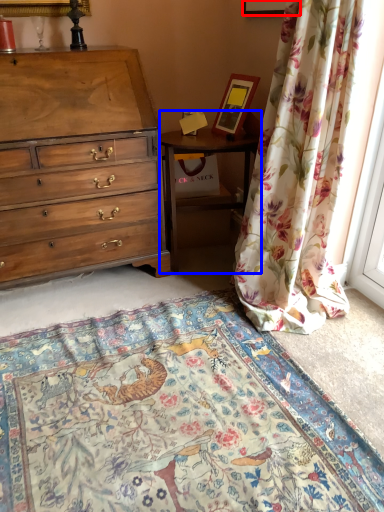
Question: Which object is closer to the camera taking this photo, picture frame (highlighted by a red box) or nightstand (highlighted by a blue box)?

Choices:
 (A) picture frame
 (B) nightstand

Answer: (A)